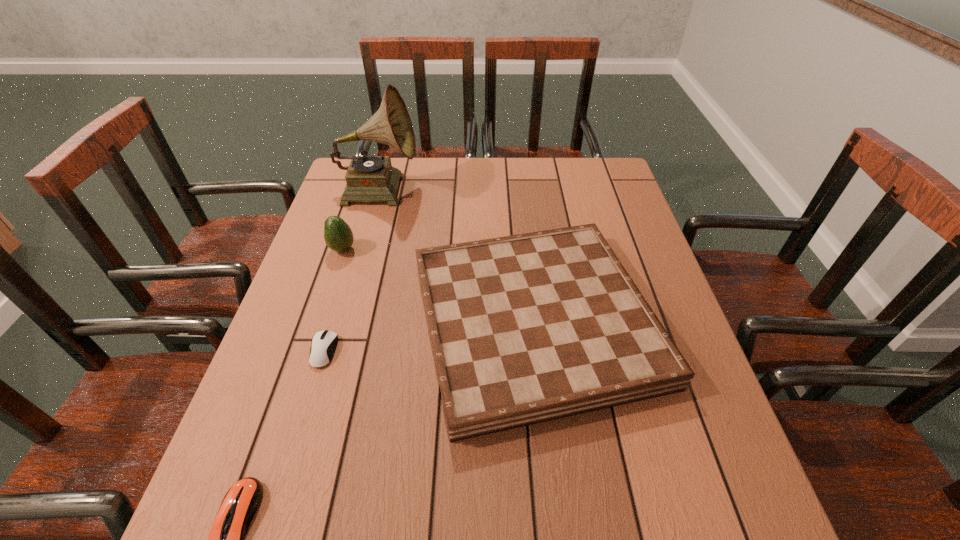
This screenshot has height=540, width=960. What are the coordinates of `object located at the far edge` in the screenshot? It's located at (x=369, y=178).

Find the location of a particular element. The width and height of the screenshot is (960, 540). record player positioned at the left edge is located at coordinates (369, 178).

Locate an element on the screen. avocado at the left edge is located at coordinates (338, 236).

Locate an element on the screen. mouse that is at the left edge is located at coordinates (324, 343).

At what (x,y) coordinates should I click in order to perform the action: click on object located in the right edge section of the desktop. Please return your answer as a coordinate pair (x, y). The image size is (960, 540). Looking at the image, I should click on (528, 328).

Where is `object at the far left corner`? The image size is (960, 540). object at the far left corner is located at coordinates (369, 178).

Locate an element on the screen. vacant area at the far edge of the desktop is located at coordinates (461, 166).

Where is `vacant space at the near edge`? This screenshot has width=960, height=540. vacant space at the near edge is located at coordinates (473, 512).

This screenshot has width=960, height=540. Identify the location of free space at the left edge of the desktop. (309, 333).

You are a GUI agent. You are given a task and a screenshot of the screen. Output one action in this format:
    pyautogui.click(x=<x>, y=<y>)
    Task: Click on the vacant space at the right edge of the desktop
    
    Given the screenshot: What is the action you would take?
    pyautogui.click(x=670, y=402)